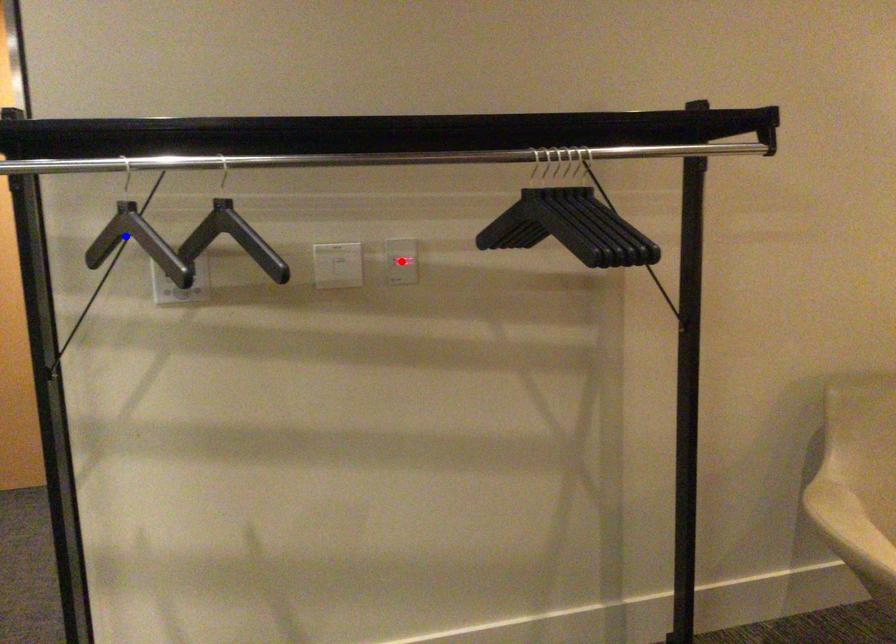
Question: In the image, two points are highlighted. Which point is nearer to the camera? Reply with the corresponding letter.

Choices:
 (A) blue point
 (B) red point

Answer: (A)